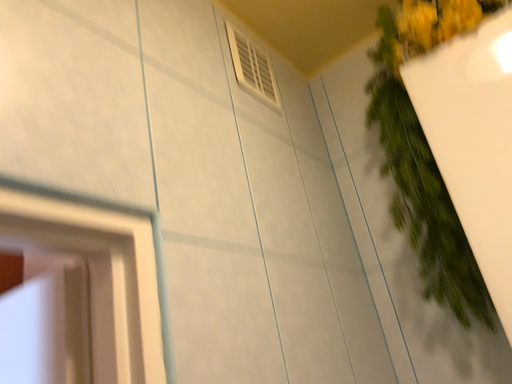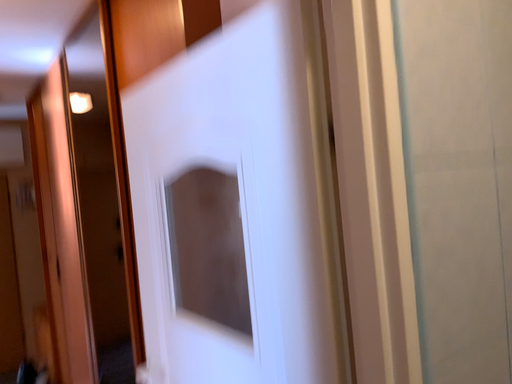
Question: How did the camera likely rotate when shooting the video?

Choices:
 (A) rotated upward
 (B) rotated downward

Answer: (B)